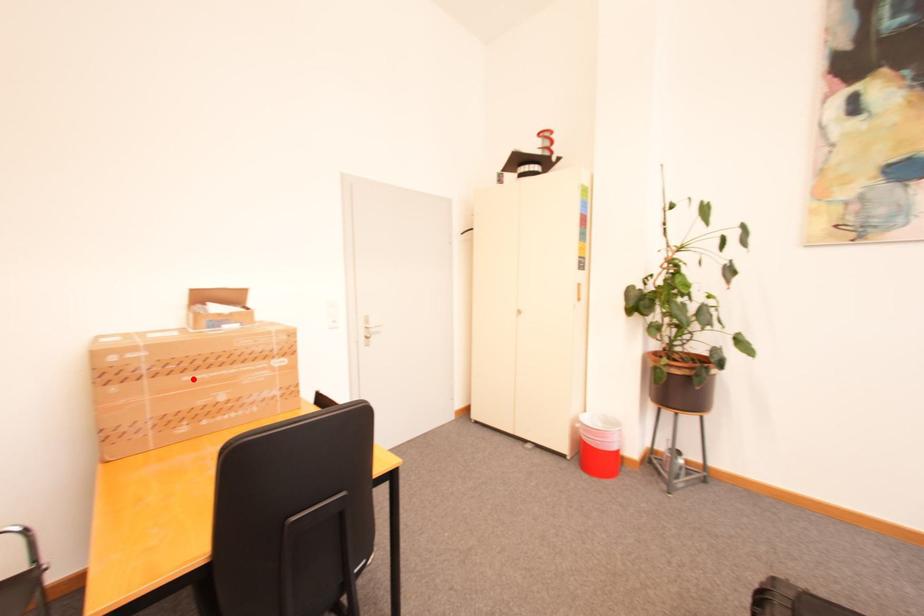
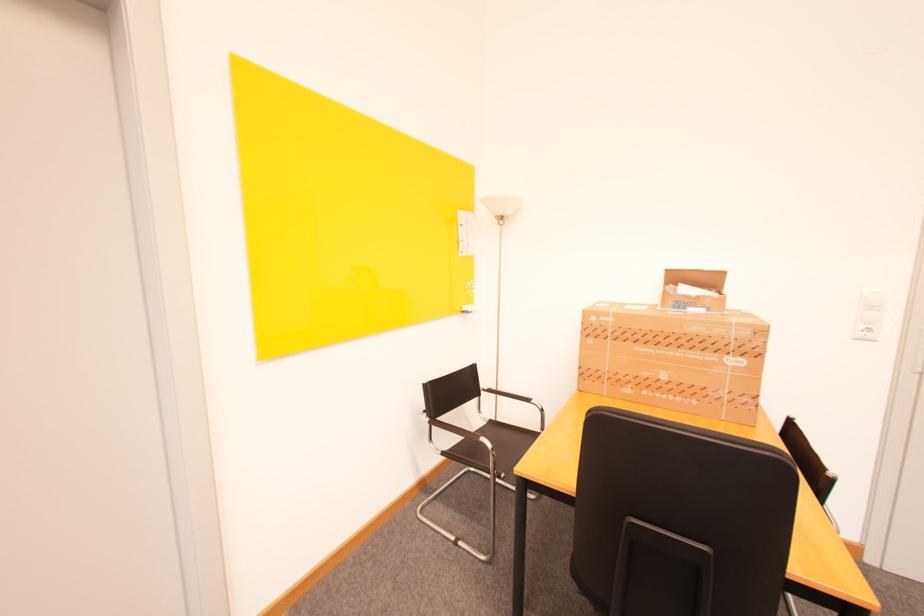
Find the pixel in the second image that matches the highlighted location in the first image.

(643, 349)